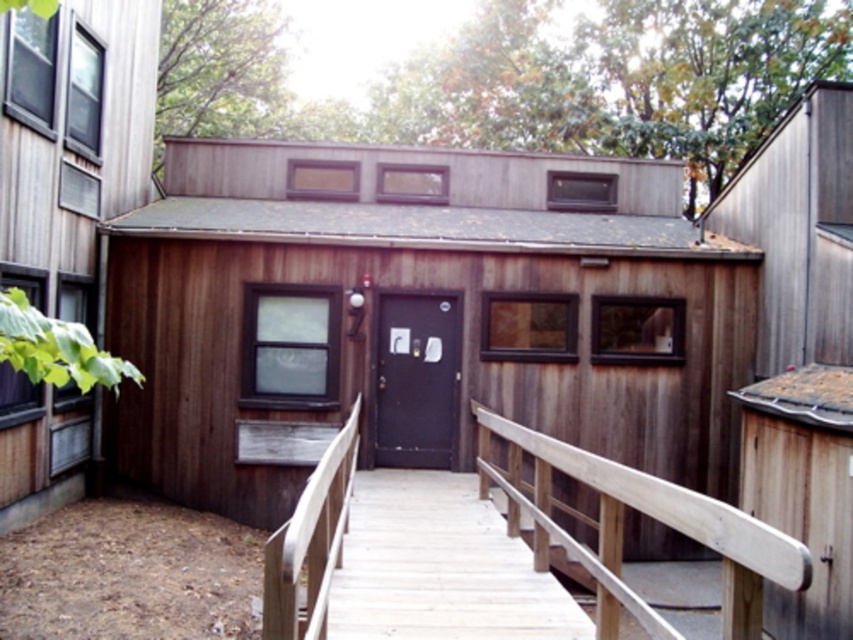
Question: Which object is positioned farthest from the light brown wooden stairs at center?

Choices:
 (A) black matte door at center
 (B) wooden handrail at center

Answer: (B)

Question: From the image, what is the correct spatial relationship of wooden handrail at center in relation to black matte door at center?

Choices:
 (A) left
 (B) right

Answer: (B)

Question: Which object is closer to the camera taking this photo?

Choices:
 (A) wooden handrail at center
 (B) black matte door at center
 (C) light brown wooden stairs at center

Answer: (A)

Question: Which object is farther from the camera taking this photo?

Choices:
 (A) wooden handrail at center
 (B) light brown wooden stairs at center
 (C) black matte door at center

Answer: (C)

Question: Does light brown wooden stairs at center have a smaller size compared to wooden handrail at center?

Choices:
 (A) yes
 (B) no

Answer: (B)

Question: In this image, where is wooden handrail at center located relative to black matte door at center?

Choices:
 (A) above
 (B) below

Answer: (B)